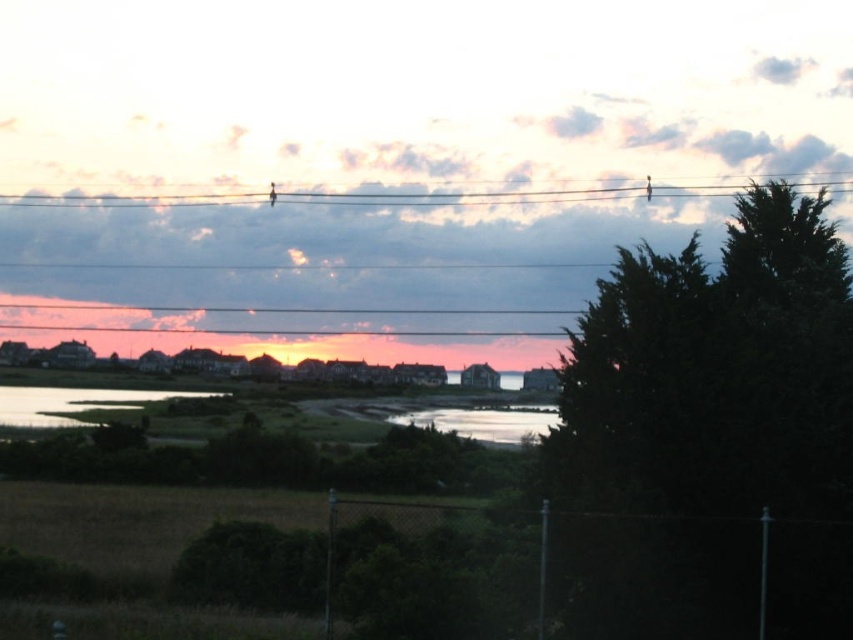
You are standing at the center of the image facing the horizon. There is a dark green textured tree at right. Where is the dark green textured tree located relative to your position?

The dark green textured tree at right is located at the right side of the image, positioned at coordinates approximately 0.588 on the x axis and 0.838 on the y axis, which places it to your right side when facing the horizon.

Looking at this image, you are a photographer planning to capture the reflection of the houses in the water. Which area of the water would you choose between the green grassy water at lower left and the silvery reflective water at center, and why?

The silvery reflective water at center is larger and more suitable for capturing the reflection of the houses because it has a bigger surface area compared to the green grassy water at lower left.

You are standing at the edge of the coastal area and want to walk towards the silvery reflective water at center. There is a dark green textured tree at right blocking your path. Which direction should you move to avoid the tree and reach the water?

The dark green textured tree at right is to the right of the silvery reflective water at center, so you should move to the left to avoid the tree and reach the water.